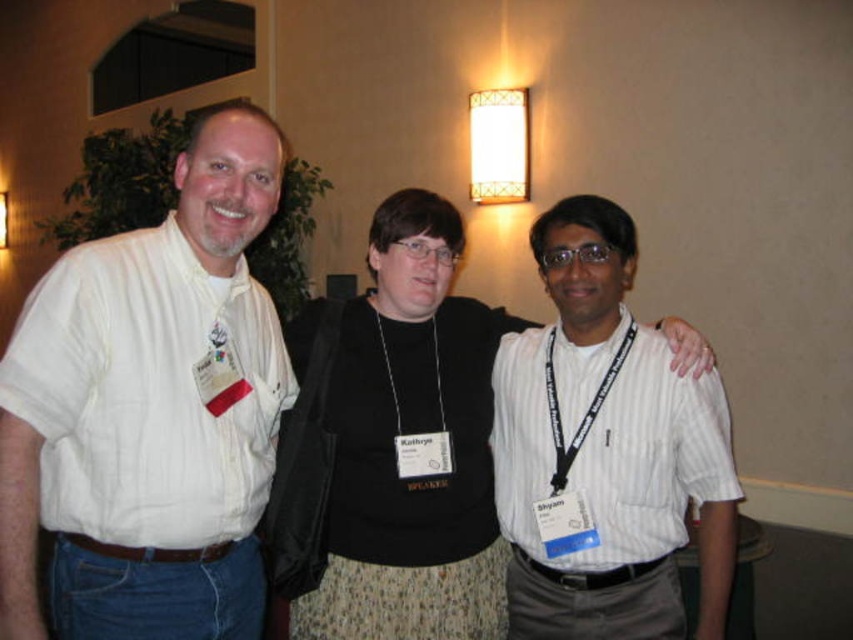
You are organizing a clothing donation drive and need to categorize shirts by size. You have two shirts to assess from the image described. The first is the white striped shirt at left, and the second is the white striped shirt at center. Based on their visual appearance, which shirt is narrower?

The white striped shirt at left has a lesser width compared to the white striped shirt at center, so the white striped shirt at left is narrower.

You are organizing a photo shoot and need to ensure that the black fabric at center and the white striped shirt at center are visible in the frame. Based on their heights, which one is more likely to block the view of the other?

The black fabric at center is taller than the white striped shirt at center, so it is more likely to block the view of the white striped shirt at center.

You are organizing a photo shoot and need to position the white striped shirt at left so that it aligns with the center of the frame. Given its current coordinates at point 0.641, 0.174, what adjustment should be made to its position?

The white striped shirt at left is currently at coordinates (148, 410). To align it with the center of the frame, move it towards the center point, which is typically at (426, 320). This means adjusting the x coordinate from 0.641 to 0.5 and the y coordinate from 0.174 to 0.5.